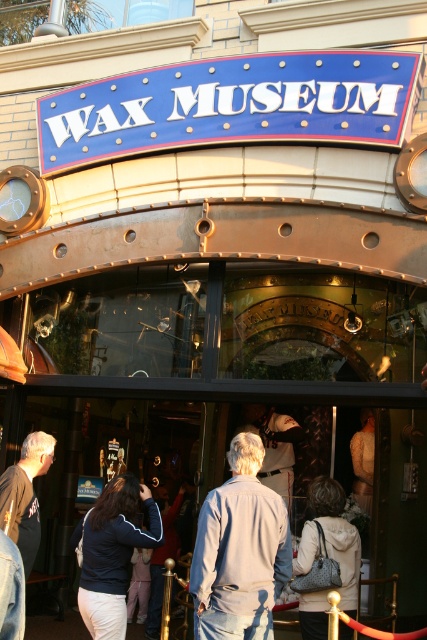
Question: Can you confirm if light gray denim jacket at center is thinner than dark blue jacket at center?

Choices:
 (A) no
 (B) yes

Answer: (A)

Question: Is light gray denim jacket at center thinner than dark blue jacket at center?

Choices:
 (A) yes
 (B) no

Answer: (B)

Question: Which of the following is the closest to the observer?

Choices:
 (A) light gray denim jacket at center
 (B) white textured coat at center

Answer: (A)

Question: Is light gray denim jacket at center thinner than gray fabric jacket at lower left?

Choices:
 (A) yes
 (B) no

Answer: (A)

Question: Which object is positioned closest to the gray fabric jacket at lower left?

Choices:
 (A) dark blue jacket at center
 (B) white textured coat at center

Answer: (A)

Question: Among these points, which one is farthest from the camera?

Choices:
 (A) (14, 531)
 (B) (129, 529)

Answer: (A)